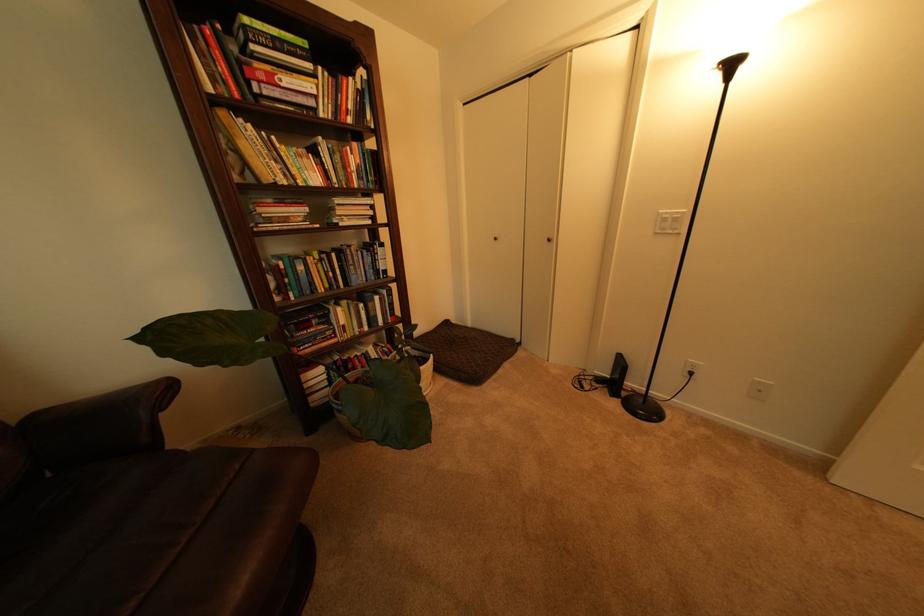
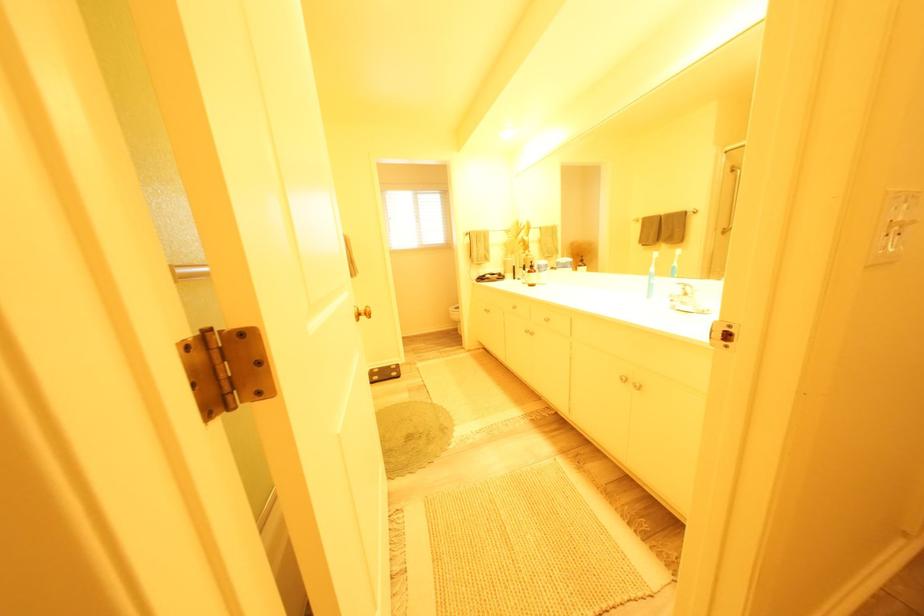
Question: What movement of the cameraman would produce the second image?

Choices:
 (A) Left
 (B) Right
 (C) Forward
 (D) Backward

Answer: (B)